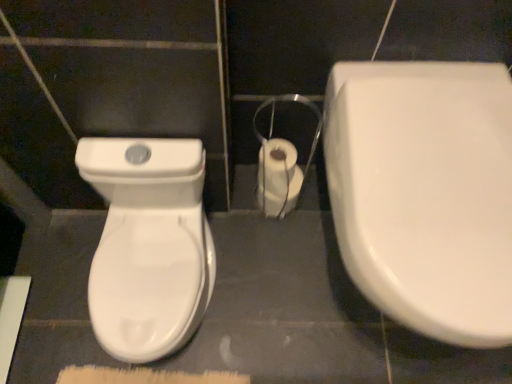
This screenshot has height=384, width=512. Identify the location of vacant area that is situated to the right of white glossy toilet at left, which is counted as the 2th toilet, starting from the right. (257, 300).